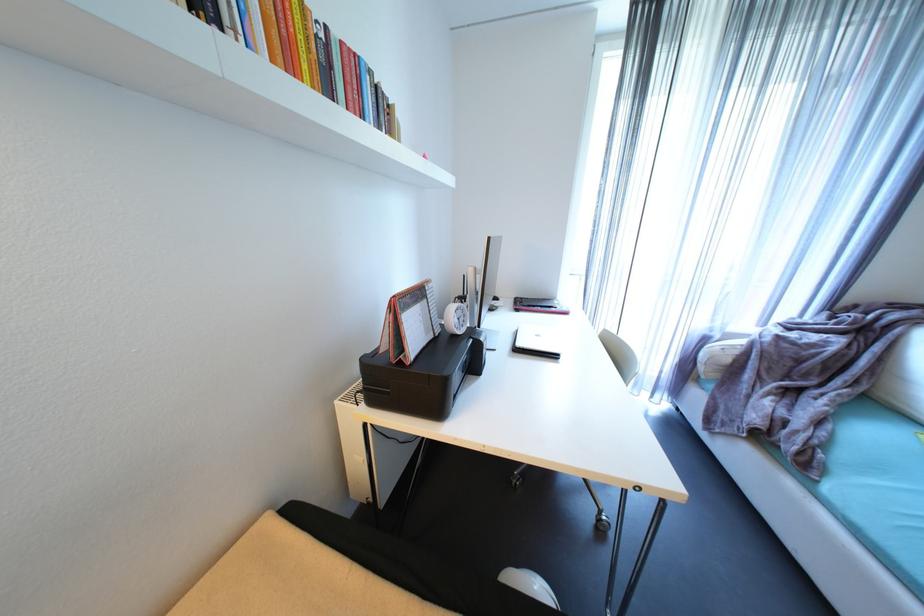
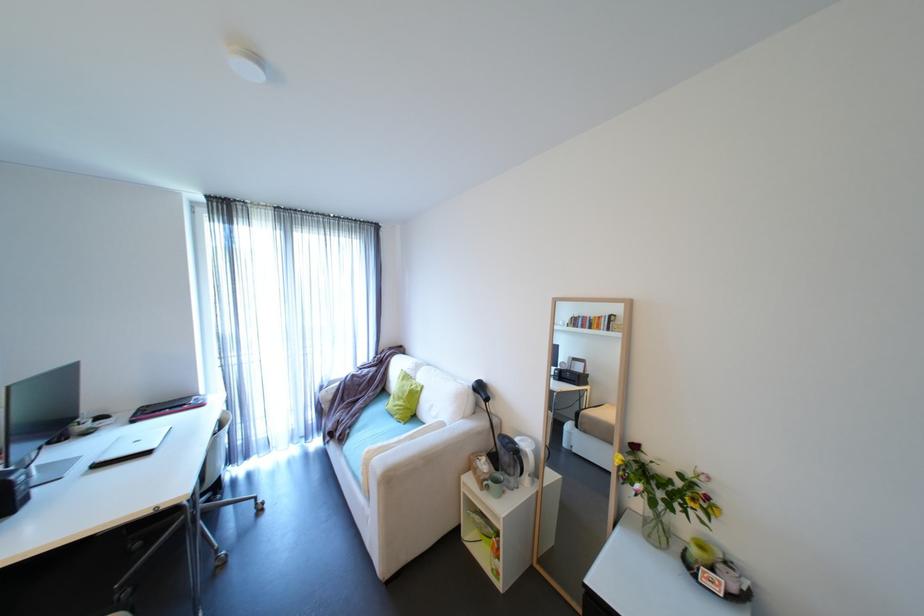
Where in the second image is the point corresponding to (723,338) from the first image?

(333, 386)